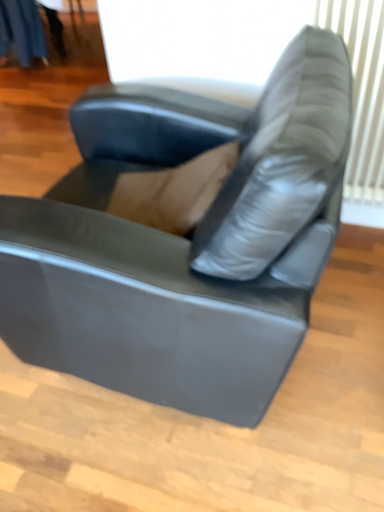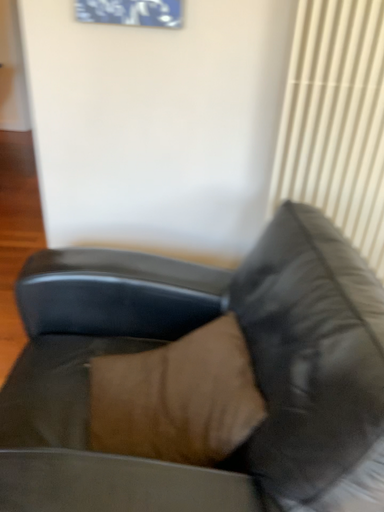
Question: Which way did the camera rotate in the video?

Choices:
 (A) rotated left
 (B) rotated right

Answer: (B)